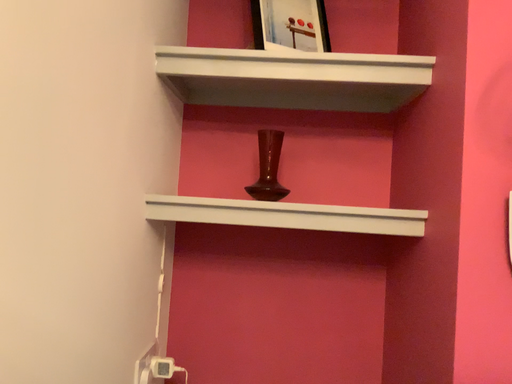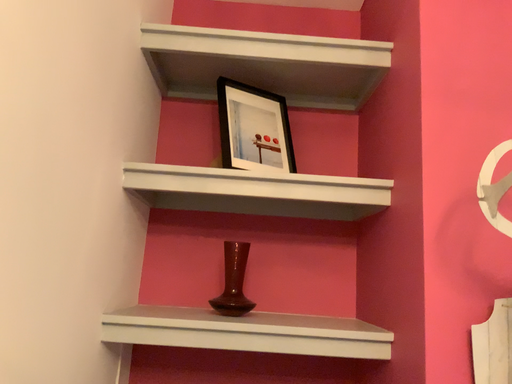
Question: How did the camera likely rotate when shooting the video?

Choices:
 (A) rotated downward
 (B) rotated upward

Answer: (B)